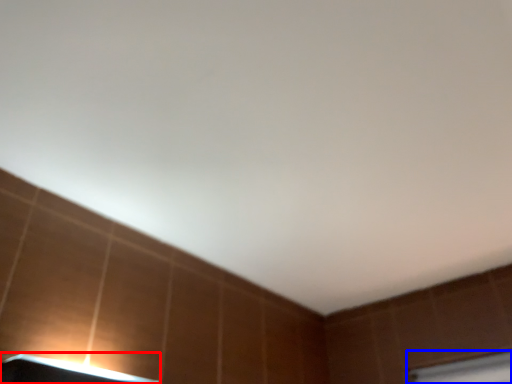
Question: Which point is further to the camera, lamp (highlighted by a red box) or window frame (highlighted by a blue box)?

Choices:
 (A) lamp
 (B) window frame

Answer: (B)